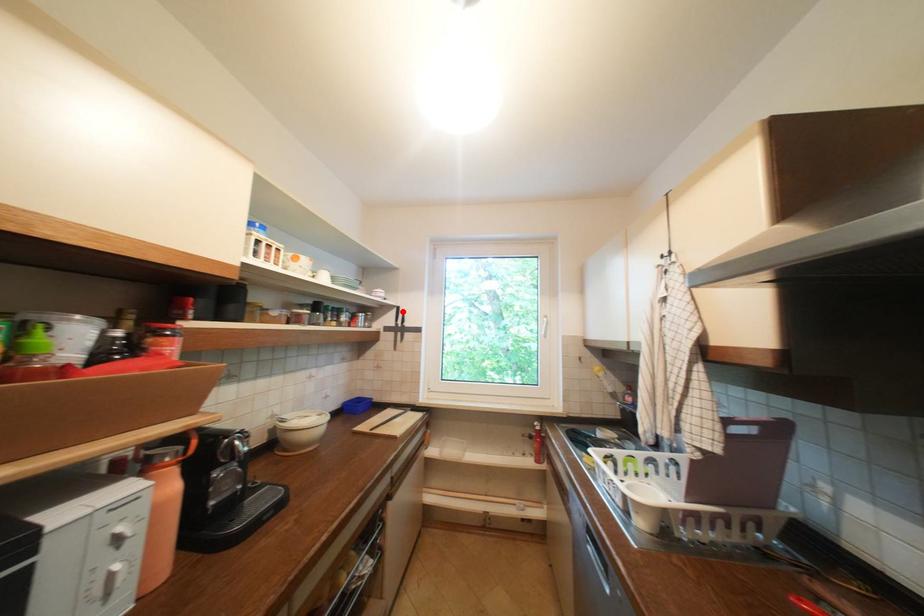
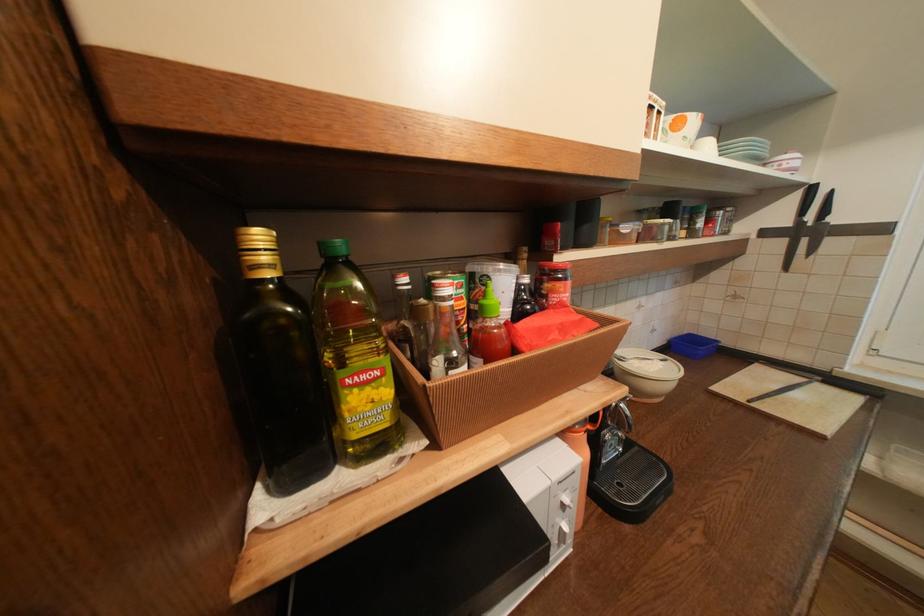
Find the pixel in the second image that matches the highlighted location in the first image.

(807, 196)